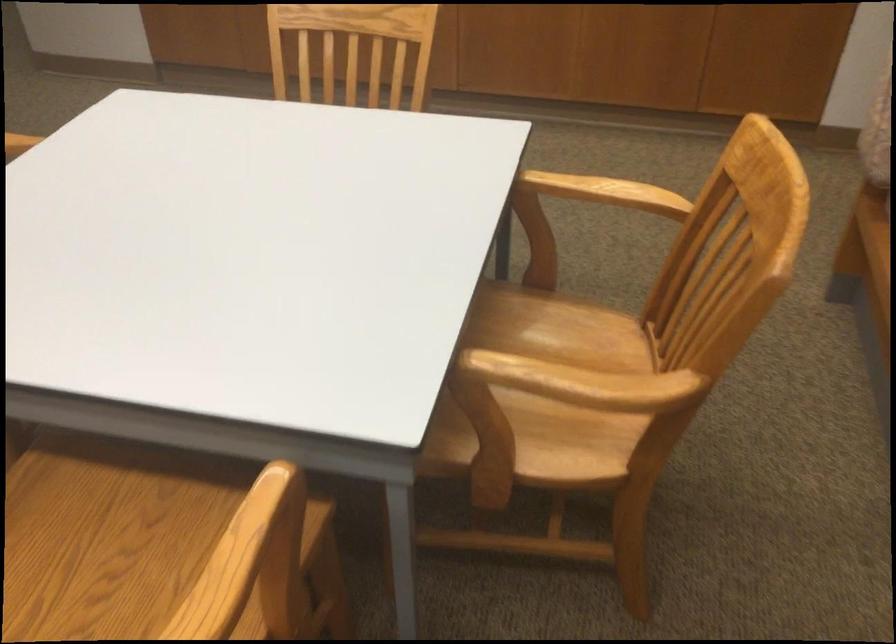
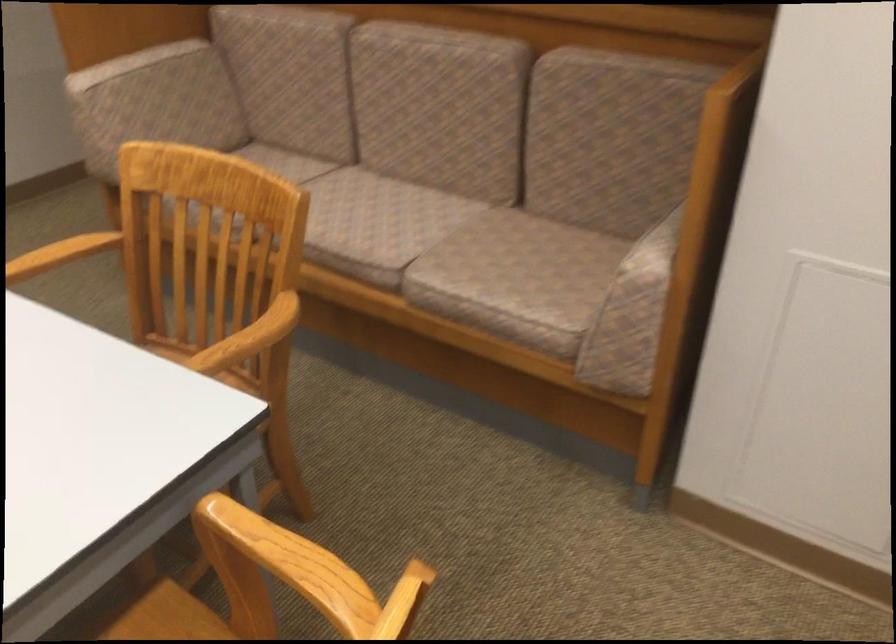
Where in the second image is the point corresponding to [581,384] from the first image?

(248, 339)